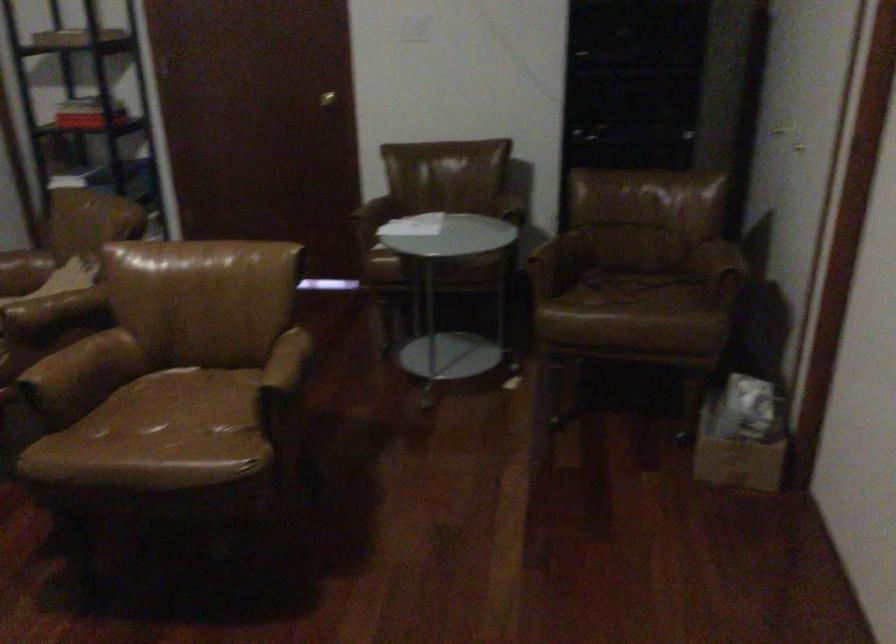
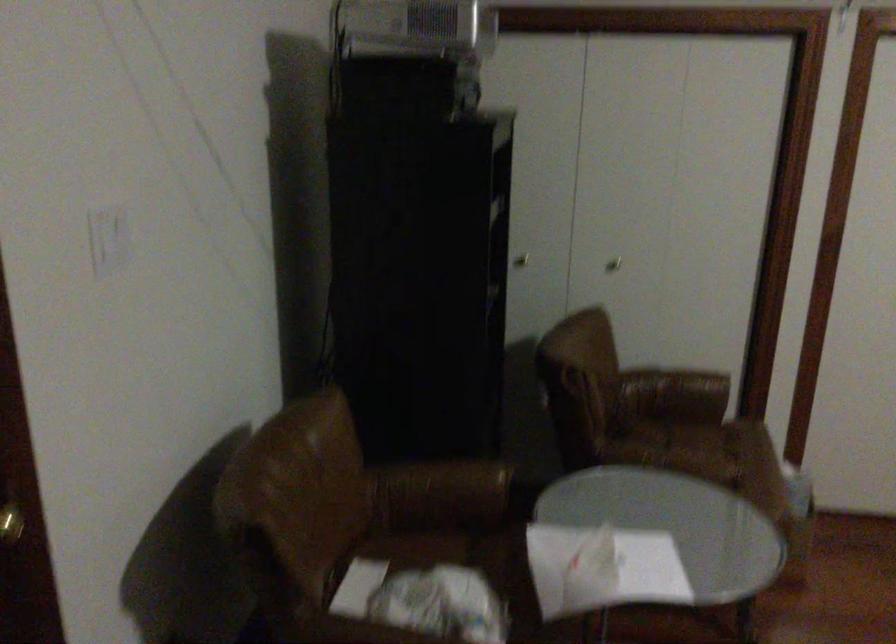
Question: I am providing you with two images of the same scene from different viewpoints. Which of the following objects are not visible in image2?

Choices:
 (A) door knob
 (B) closet door knob
 (C) chair armrest
 (D) none of these

Answer: (D)